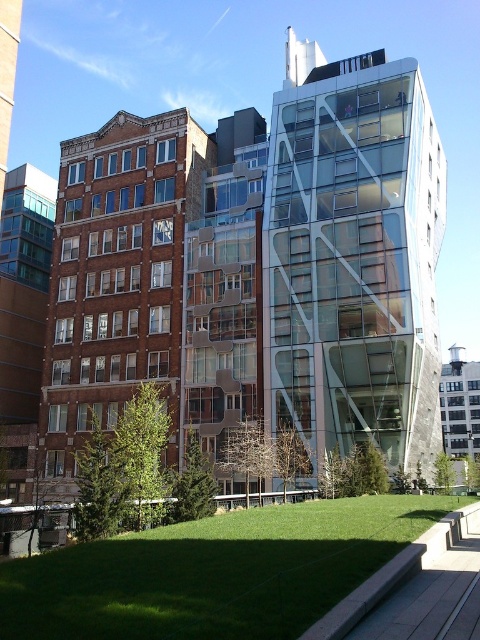
In the scene shown: You are a city planner trying to decide where to place a new 10m wide statue. The statue must be placed either in front of the transparent glass building at center or on the green grass at lower center. Based on the scene, which location has enough space to accommodate the statue without overlapping with other objects?

The green grass at lower center has enough space because its width is greater than the transparent glass building at center, which is narrower and cannot fit the 10m wide statue.

You are a city planner reviewing this urban design. You notice the transparent glass building at center and the green grass at lower center. Which object occupies more space in the image?

The transparent glass building at center is bigger than green grass at lower center, so it occupies more space in the image.

You are an urban planner analyzing the layout of this city block. You need to determine the exact position of the transparent glass building at center relative to the traditional brick building on the left. Can you provide its coordinates?

The transparent glass building at center is located at coordinates point (352, 257).